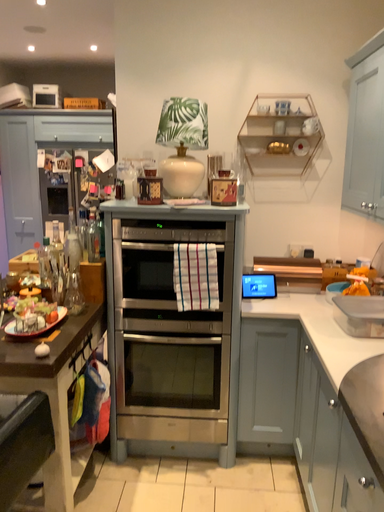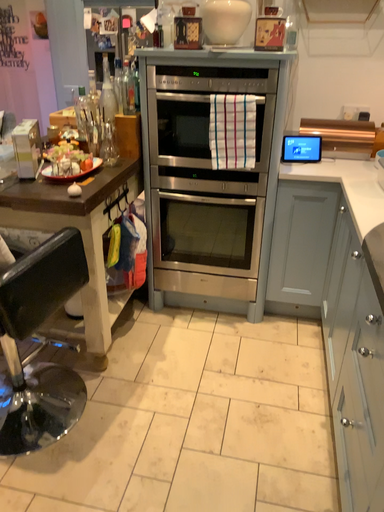
Question: Which way did the camera rotate in the video?

Choices:
 (A) rotated downward
 (B) rotated upward

Answer: (A)